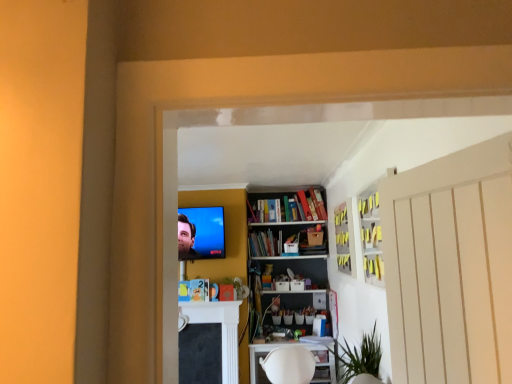
Question: Is white plastic table at lower center positioned beyond the bounds of yellow matte cabinet at upper center, the second cabinet from the front?

Choices:
 (A) no
 (B) yes

Answer: (B)

Question: Could yellow matte cabinet at upper center, the second cabinet from the front, be considered to be inside white plastic table at lower center?

Choices:
 (A) yes
 (B) no

Answer: (B)

Question: From the image's perspective, is white plastic table at lower center over yellow matte cabinet at upper center, the second cabinet from the front?

Choices:
 (A) no
 (B) yes

Answer: (A)

Question: Does white plastic table at lower center have a lesser height compared to yellow matte cabinet at upper center, the second cabinet from the front?

Choices:
 (A) yes
 (B) no

Answer: (A)

Question: Considering the relative sizes of white plastic table at lower center and yellow matte cabinet at upper center, the second cabinet from the front, in the image provided, is white plastic table at lower center taller than yellow matte cabinet at upper center, the second cabinet from the front,?

Choices:
 (A) yes
 (B) no

Answer: (B)

Question: From a real-world perspective, does white plastic table at lower center sit lower than yellow matte cabinet at upper center, the second cabinet from the front?

Choices:
 (A) yes
 (B) no

Answer: (A)

Question: Can you confirm if white glossy cabinet at upper right, the first cabinet in the front-to-back sequence, is shorter than white plastic table at lower center?

Choices:
 (A) yes
 (B) no

Answer: (B)

Question: Is white glossy cabinet at upper right, the first cabinet in the front-to-back sequence, at the right side of white plastic table at lower center?

Choices:
 (A) no
 (B) yes

Answer: (B)

Question: Is white glossy cabinet at upper right, which is the 2th cabinet in back-to-front order, turned away from white plastic table at lower center?

Choices:
 (A) yes
 (B) no

Answer: (B)

Question: Is the depth of white glossy cabinet at upper right, the first cabinet in the front-to-back sequence, less than that of white plastic table at lower center?

Choices:
 (A) no
 (B) yes

Answer: (B)

Question: From the image's perspective, is white glossy cabinet at upper right, the first cabinet in the front-to-back sequence, located beneath white plastic table at lower center?

Choices:
 (A) no
 (B) yes

Answer: (A)

Question: From the image's perspective, is white glossy cabinet at upper right, which is the 2th cabinet in back-to-front order, located above white plastic table at lower center?

Choices:
 (A) no
 (B) yes

Answer: (B)

Question: Is green matte plant at center not within matte yellow book at center, placed as the second book when sorted from right to left?

Choices:
 (A) yes
 (B) no

Answer: (A)